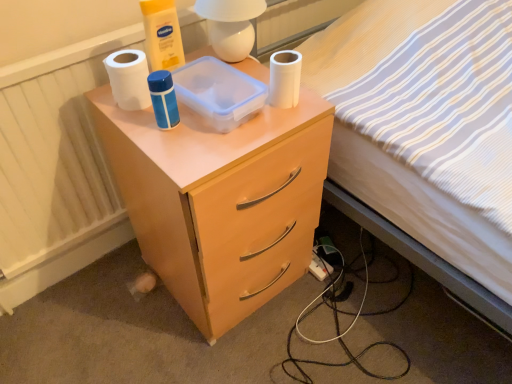
At what (x,y) coordinates should I click in order to perform the action: click on vacant space in front of white matte toilet paper at upper left, which is counted as the second toilet paper, starting from the right. Please return your answer as a coordinate pair (x, y). Image resolution: width=512 pixels, height=384 pixels. Looking at the image, I should click on (155, 135).